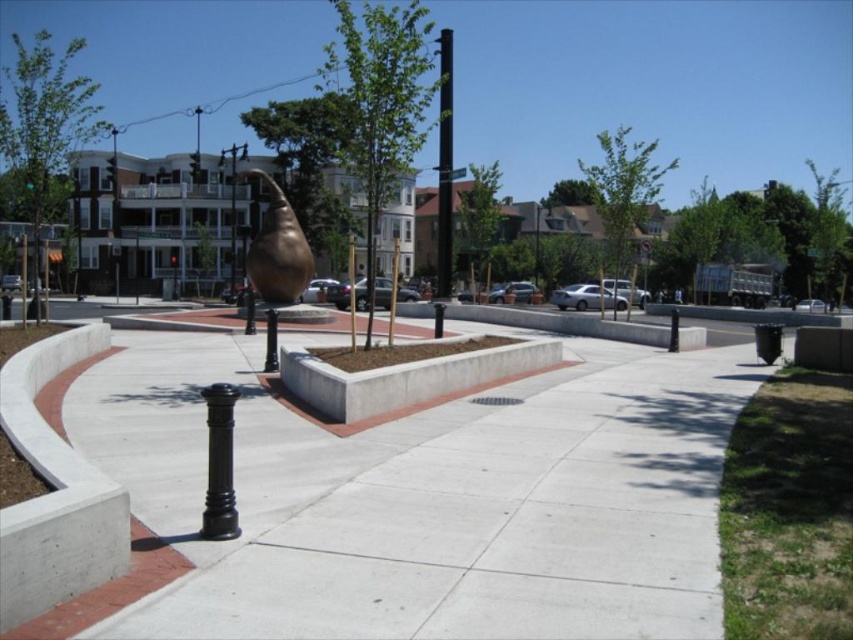
Question: Which object appears farthest from the camera in this image?

Choices:
 (A) bronze sculpture at center
 (B) black metal pole at center
 (C) concrete at center
 (D) metallic pole at upper center

Answer: (D)

Question: Which object is closer to the camera taking this photo?

Choices:
 (A) bronze sculpture at center
 (B) bronze metallic lamp post at upper left
 (C) concrete at center

Answer: (C)

Question: Where is concrete at center located in relation to bronze metallic lamp post at upper left in the image?

Choices:
 (A) left
 (B) right

Answer: (B)

Question: Which point appears closest to the camera in this image?

Choices:
 (A) (113, 273)
 (B) (166, 440)

Answer: (B)

Question: Where is concrete at center located in relation to metallic pole at upper center in the image?

Choices:
 (A) below
 (B) above

Answer: (A)

Question: Where is bronze sculpture at center located in relation to metallic pole at upper center in the image?

Choices:
 (A) right
 (B) left

Answer: (A)